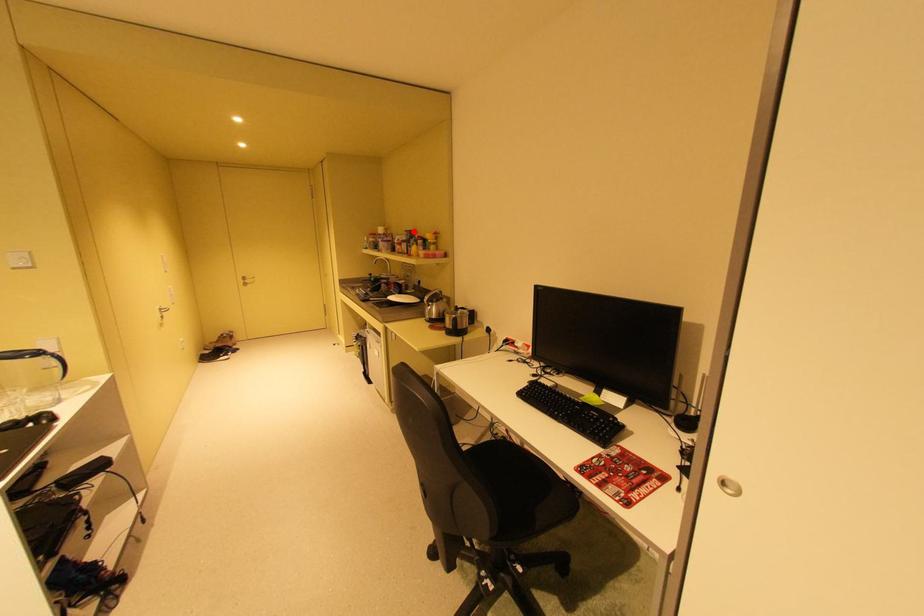
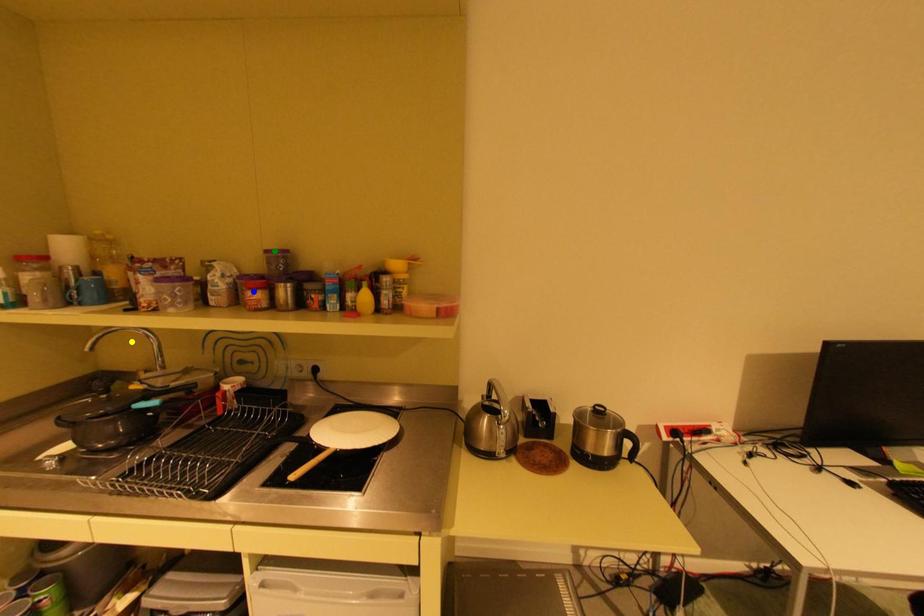
Question: I am providing you with two images of the same scene from different viewpoints. A red point is marked on the first image. You are given multiple points on the second image. Which spot in image 2 lines up with the point in image 1?

Choices:
 (A) blue point
 (B) yellow point
 (C) green point

Answer: (C)